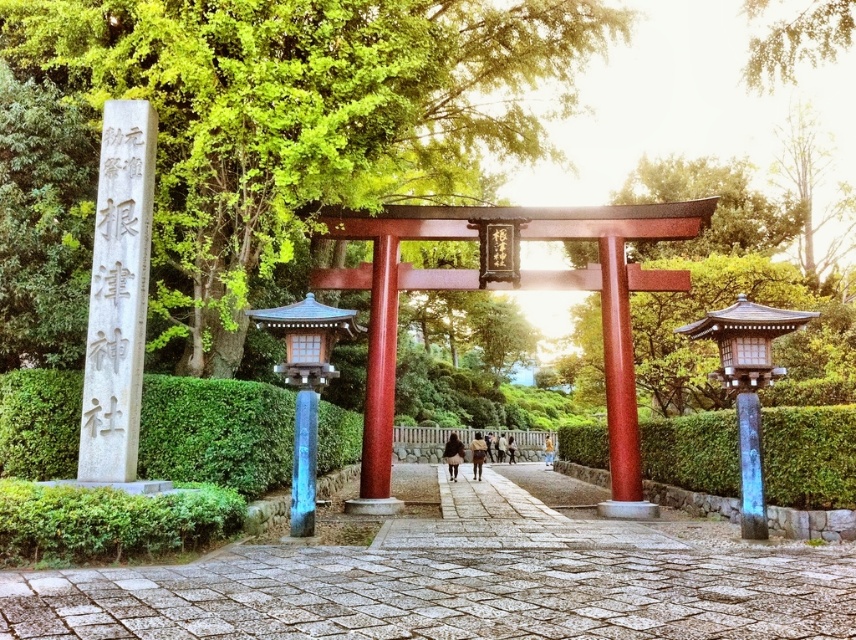
Find the location of a particular element. The width and height of the screenshot is (856, 640). white stone pillar at left is located at coordinates (117, 296).

Which of these two, white stone pillar at left or glossy wood pole at center, stands shorter?

With less height is white stone pillar at left.

This screenshot has height=640, width=856. Describe the element at coordinates (117, 296) in the screenshot. I see `white stone pillar at left` at that location.

I want to click on white stone pillar at left, so pos(117,296).

Is gray stone path at center behind glossy wood pole at center?

That is False.

Can you confirm if gray stone path at center is positioned above glossy wood pole at center?

No, gray stone path at center is not above glossy wood pole at center.

Locate an element on the screen. The width and height of the screenshot is (856, 640). gray stone path at center is located at coordinates (459, 582).

Which is in front, point (299, 440) or point (378, 500)?

Point (299, 440)

Which of these two, wooden lantern at center or glossy wood pole at center, stands shorter?

wooden lantern at center is shorter.

Is point (313, 444) positioned after point (387, 444)?

No, (313, 444) is closer to viewer.

You are a GUI agent. You are given a task and a screenshot of the screen. Output one action in this format:
    pyautogui.click(x=<x>, y=<y>)
    Task: Click on the wooden lantern at center
    
    Given the screenshot: What is the action you would take?
    pyautogui.click(x=305, y=385)